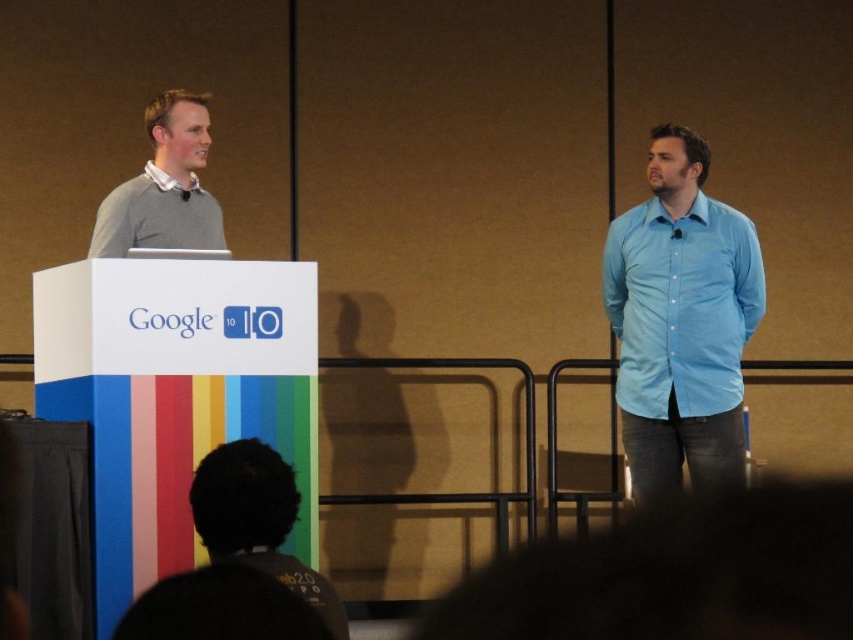
Question: Can you confirm if light blue cotton shirt at right is thinner than dark hair at lower center?

Choices:
 (A) no
 (B) yes

Answer: (A)

Question: Can you confirm if dark hair at lower center is wider than matte gray sweater at left?

Choices:
 (A) no
 (B) yes

Answer: (A)

Question: Among these points, which one is nearest to the camera?

Choices:
 (A) (659, 305)
 (B) (265, 451)

Answer: (B)

Question: Which point is farther from the camera taking this photo?

Choices:
 (A) (152, 234)
 (B) (219, 509)

Answer: (A)

Question: Can you confirm if dark hair at lower center is positioned above matte gray sweater at left?

Choices:
 (A) yes
 (B) no

Answer: (B)

Question: Which of the following is the closest to the observer?

Choices:
 (A) light blue cotton shirt at right
 (B) matte gray sweater at left
 (C) dark hair at lower center

Answer: (C)